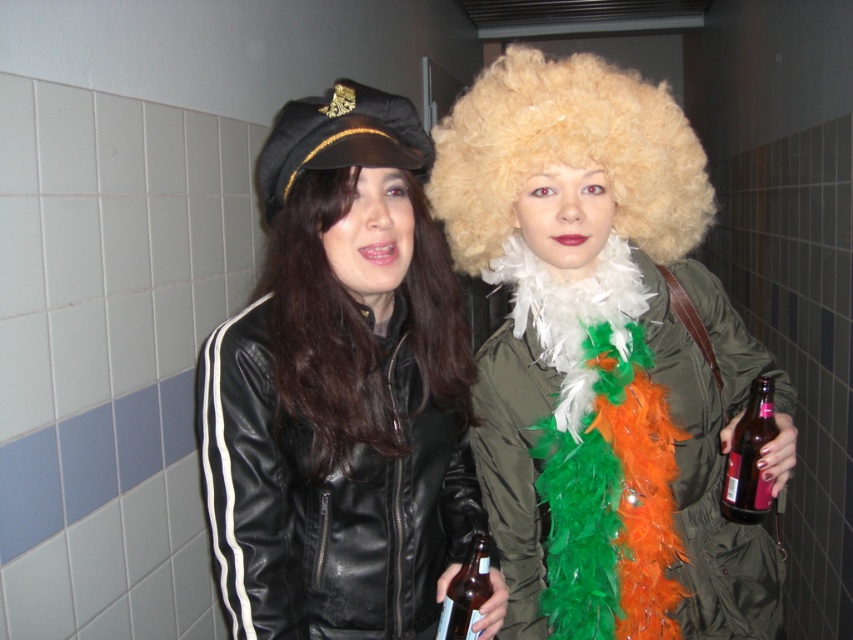
You are a photographer setting up a shot of the two people in the image. You need to position a spotlight to highlight both the blonde curly wig at upper center and the blonde feather boa at center. Which object should you aim the spotlight higher to properly illuminate?

The blonde curly wig at upper center should be illuminated with the spotlight aimed higher because it has a greater height compared to the blonde feather boa at center.

You are a photographer trying to capture a clear shot of the brown glass bottle at center without the blonde curly wig at upper center blocking it. Can you angle your camera downward to achieve this?

The blonde curly wig at upper center is positioned over the brown glass bottle at center, so angling the camera downward might help avoid the wig blocking the bottle.

You are a photographer setting up a shoot with two models. One has a blonde curly wig at upper center and the other has a blonde feather boa at center. You need to adjust the lighting so that the wig is more illuminated than the boa. Which object should you focus your light on first?

The blonde curly wig at upper center is closer to the viewer than the blonde feather boa at center, so focusing the light on the blonde curly wig at upper center first will ensure it appears more illuminated.